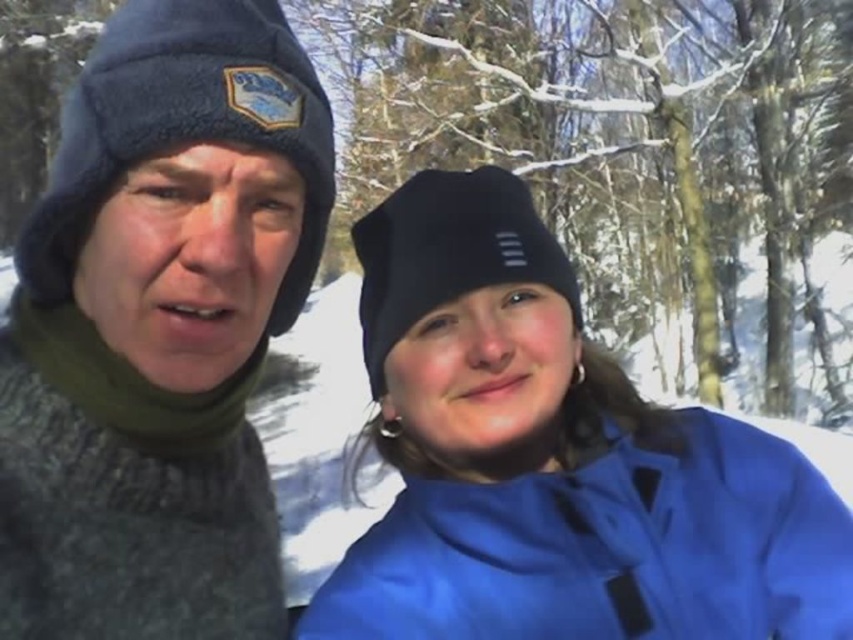
Question: Is knitted wool sweater at left thinner than blue matte jacket at center?

Choices:
 (A) no
 (B) yes

Answer: (B)

Question: Which object appears closest to the camera in this image?

Choices:
 (A) knitted wool sweater at left
 (B) blue matte jacket at center

Answer: (A)

Question: Where is knitted wool sweater at left located in relation to blue matte jacket at center in the image?

Choices:
 (A) right
 (B) left

Answer: (B)

Question: Among these objects, which one is farthest from the camera?

Choices:
 (A) blue matte jacket at center
 (B) knitted wool sweater at left

Answer: (A)

Question: Can you confirm if knitted wool sweater at left is positioned below blue matte jacket at center?

Choices:
 (A) yes
 (B) no

Answer: (B)